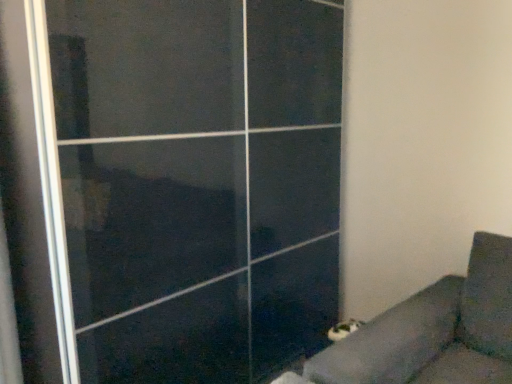
You are a GUI agent. You are given a task and a screenshot of the screen. Output one action in this format:
    pyautogui.click(x=<x>, y=<y>)
    Task: Click on the transparent glass screen door at center
    Image resolution: width=512 pixels, height=384 pixels.
    Given the screenshot: What is the action you would take?
    pyautogui.click(x=176, y=186)

This screenshot has width=512, height=384. Describe the element at coordinates (176, 186) in the screenshot. I see `transparent glass screen door at center` at that location.

You are a GUI agent. You are given a task and a screenshot of the screen. Output one action in this format:
    pyautogui.click(x=<x>, y=<y>)
    Task: Click on the transparent glass screen door at center
    
    Given the screenshot: What is the action you would take?
    pyautogui.click(x=176, y=186)